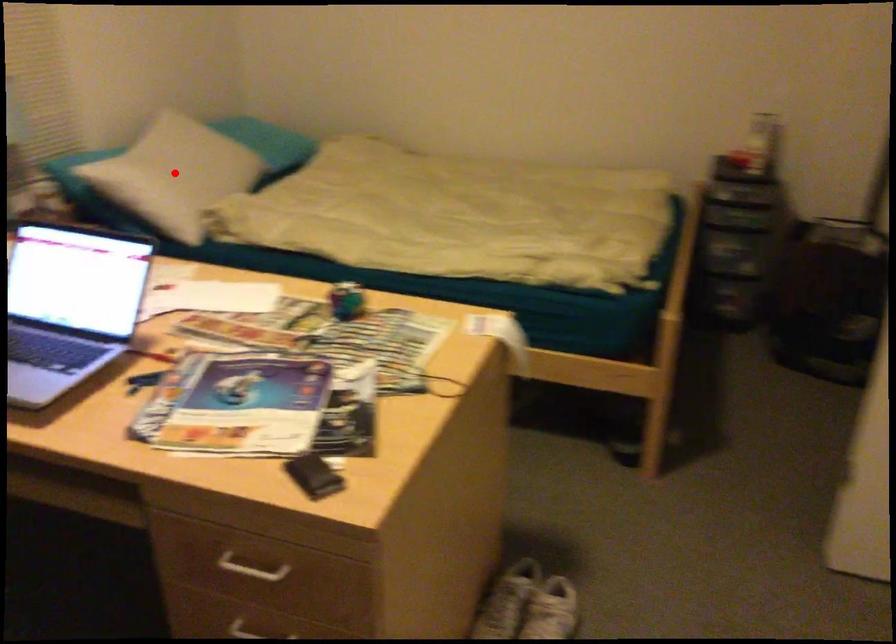
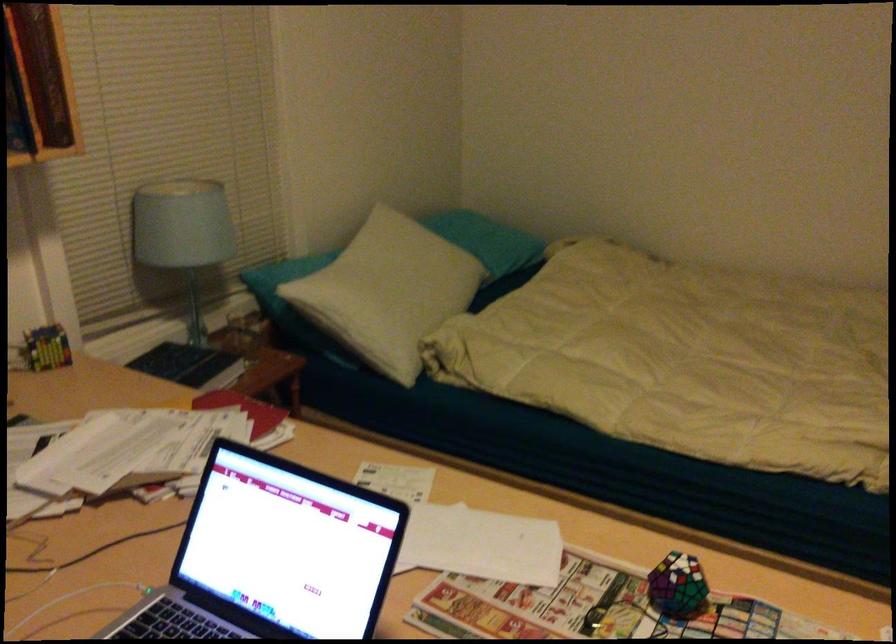
Question: I am providing you with two images of the same scene from different viewpoints. A red point is shown in image1. For the corresponding object point in image2, is it positioned nearer or farther from the camera?

Choices:
 (A) Nearer
 (B) Farther

Answer: (A)